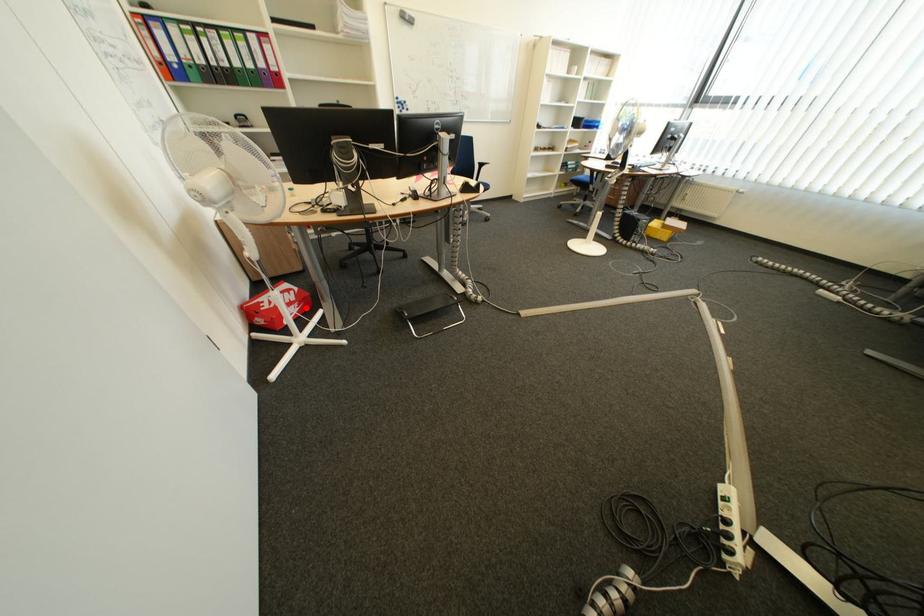
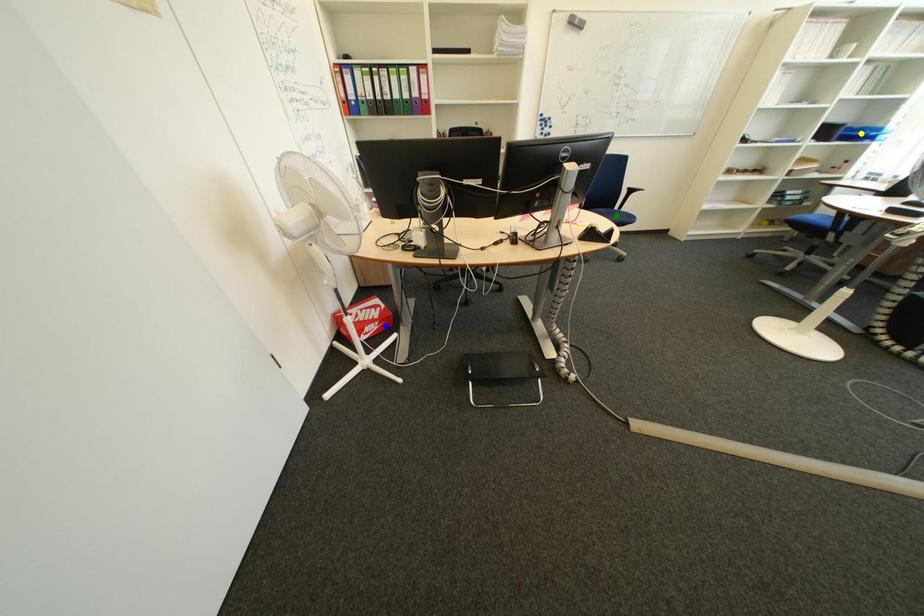
Question: I am providing you with two images of the same scene from different viewpoints. A red point is marked on the first image. You are given multiple points on the second image. Which spot in image 2 lines up with the point in image 1?

Choices:
 (A) blue point
 (B) green point
 (C) yellow point

Answer: (A)